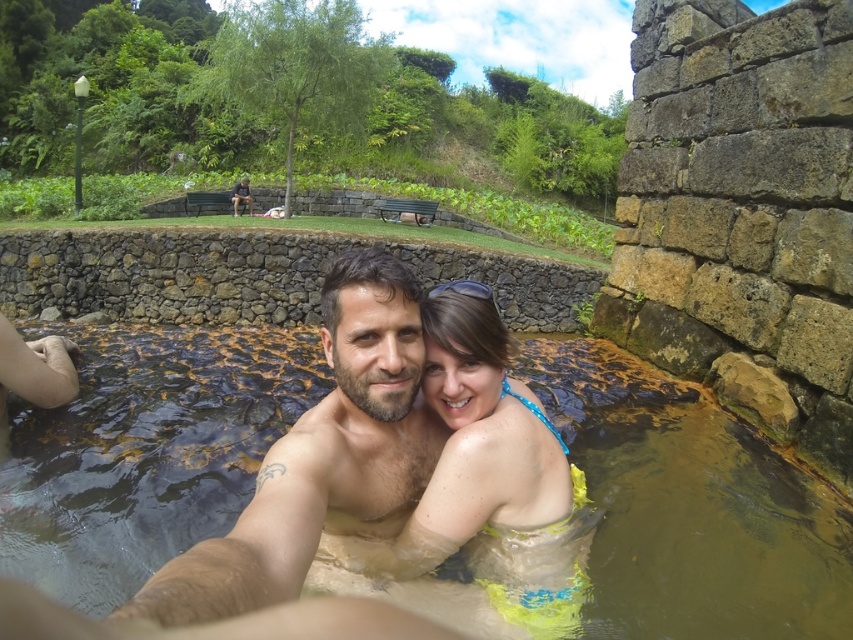
Who is taller, brown murky water at center or smooth skin man at center?

brown murky water at center is taller.

Between brown murky water at center and smooth skin man at center, which one is positioned higher?

smooth skin man at center is higher up.

Which is behind, point (233, 516) or point (341, 296)?

The point (233, 516) is behind.

Where is `brown murky water at center`? The width and height of the screenshot is (853, 640). brown murky water at center is located at coordinates (688, 506).

Which is in front, point (335, 285) or point (515, 602)?

Point (515, 602) is more forward.

You are a GUI agent. You are given a task and a screenshot of the screen. Output one action in this format:
    pyautogui.click(x=<x>, y=<y>)
    Task: Click on the smooth skin man at center
    
    Given the screenshot: What is the action you would take?
    pyautogui.click(x=317, y=481)

Can you confirm if brown murky water at center is wider than neon yellow fabric at center?

Yes, brown murky water at center is wider than neon yellow fabric at center.

Between brown murky water at center and neon yellow fabric at center, which one has more height?

neon yellow fabric at center is taller.

Find the location of `brown murky water at center`. brown murky water at center is located at coordinates (688, 506).

At what (x,y) coordinates should I click in order to perform the action: click on brown murky water at center. Please return your answer as a coordinate pair (x, y). The height and width of the screenshot is (640, 853). Looking at the image, I should click on (688, 506).